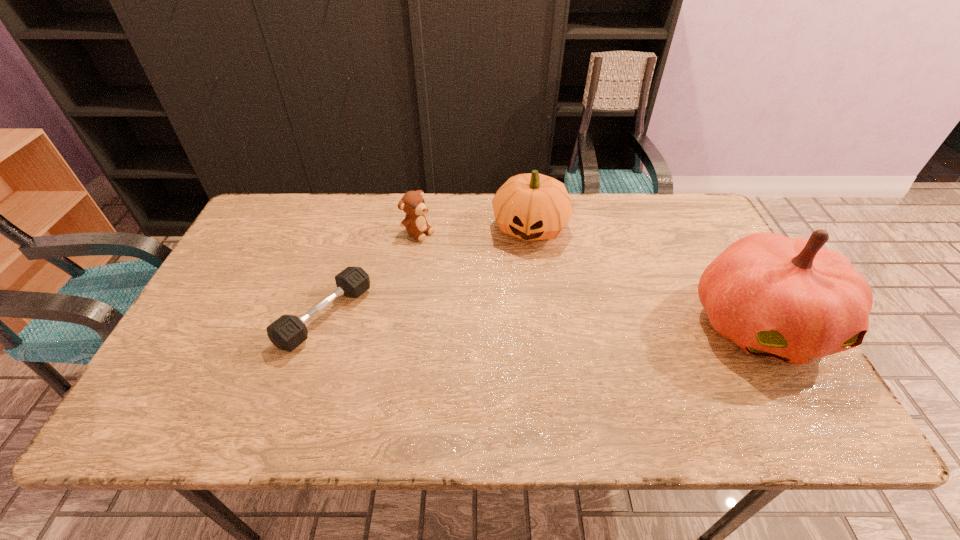
Where is `free space between the gourd and the leftmost object`? Image resolution: width=960 pixels, height=540 pixels. free space between the gourd and the leftmost object is located at coordinates (428, 271).

Locate an element on the screen. This screenshot has width=960, height=540. free point between the third object from right to left and the gourd is located at coordinates (474, 229).

Locate an element on the screen. free space that is in between the teddy bear and the shortest object is located at coordinates (372, 274).

This screenshot has width=960, height=540. In order to click on empty space that is in between the leftmost object and the third tallest object in this screenshot , I will do `click(372, 274)`.

Find the location of a particular element. Image resolution: width=960 pixels, height=540 pixels. vacant space that's between the third object from right to left and the pumpkin is located at coordinates (590, 278).

Where is `free point between the third tallest object and the pumpkin`? The image size is (960, 540). free point between the third tallest object and the pumpkin is located at coordinates (590, 278).

Point out which object is positioned as the second nearest to the shortest object. Please provide its 2D coordinates. Your answer should be formatted as a tuple, i.e. [(x, y)], where the tuple contains the x and y coordinates of a point satisfying the conditions above.

[(532, 206)]

Locate which object ranks in proximity to the second tallest object. Please provide its 2D coordinates. Your answer should be formatted as a tuple, i.e. [(x, y)], where the tuple contains the x and y coordinates of a point satisfying the conditions above.

[(412, 203)]

Identify the location of blank space that satisfies the following two spatial constraints: 1. on the back side of the second object from left to right; 2. on the left side of the shortest object. The image size is (960, 540). (352, 232).

Where is `vacant space that satisfies the following two spatial constraints: 1. on the back side of the leftmost object; 2. on the right side of the third object from left to right`? The image size is (960, 540). vacant space that satisfies the following two spatial constraints: 1. on the back side of the leftmost object; 2. on the right side of the third object from left to right is located at coordinates (354, 227).